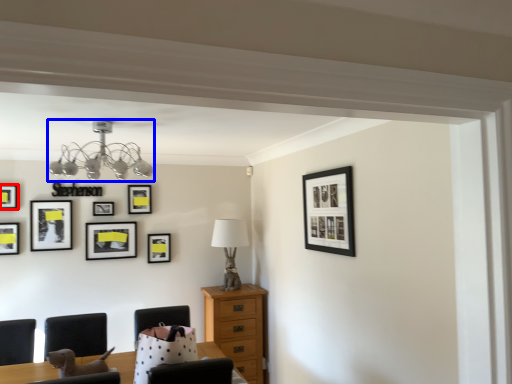
Question: Which point is further to the camera, picture frame (highlighted by a red box) or lamp (highlighted by a blue box)?

Choices:
 (A) picture frame
 (B) lamp

Answer: (A)